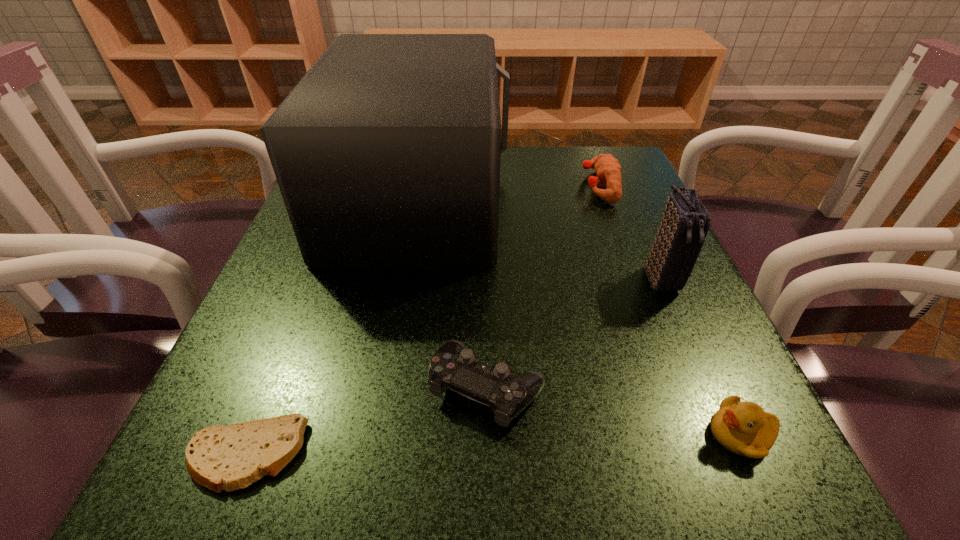
In the image, there is a desktop. What are the coordinates of `vacant space at the near edge` in the screenshot? It's located at (598, 484).

In the image, there is a desktop. Identify the location of vacant space at the left edge. The width and height of the screenshot is (960, 540). (335, 318).

Where is `free location at the right edge of the desktop`? This screenshot has width=960, height=540. free location at the right edge of the desktop is located at coordinates (643, 286).

You are a GUI agent. You are given a task and a screenshot of the screen. Output one action in this format:
    pyautogui.click(x=<x>, y=<y>)
    Task: Click on the vacant space at the far right corner
    
    Given the screenshot: What is the action you would take?
    pyautogui.click(x=588, y=174)

Locate an element on the screen. vacant space in between the control and the duckling is located at coordinates (613, 411).

Image resolution: width=960 pixels, height=540 pixels. In order to click on empty location between the microwave oven and the control in this screenshot , I will do `click(453, 293)`.

I want to click on vacant area that lies between the fifth shortest object and the puncher, so click(630, 232).

Where is `free space between the tallest object and the puncher`? This screenshot has width=960, height=540. free space between the tallest object and the puncher is located at coordinates (509, 193).

This screenshot has width=960, height=540. Find the location of `vacant point located between the puncher and the duckling`. vacant point located between the puncher and the duckling is located at coordinates (669, 310).

Locate an element on the screen. This screenshot has height=540, width=960. vacant space that is in between the microwave oven and the shortest object is located at coordinates 333,327.